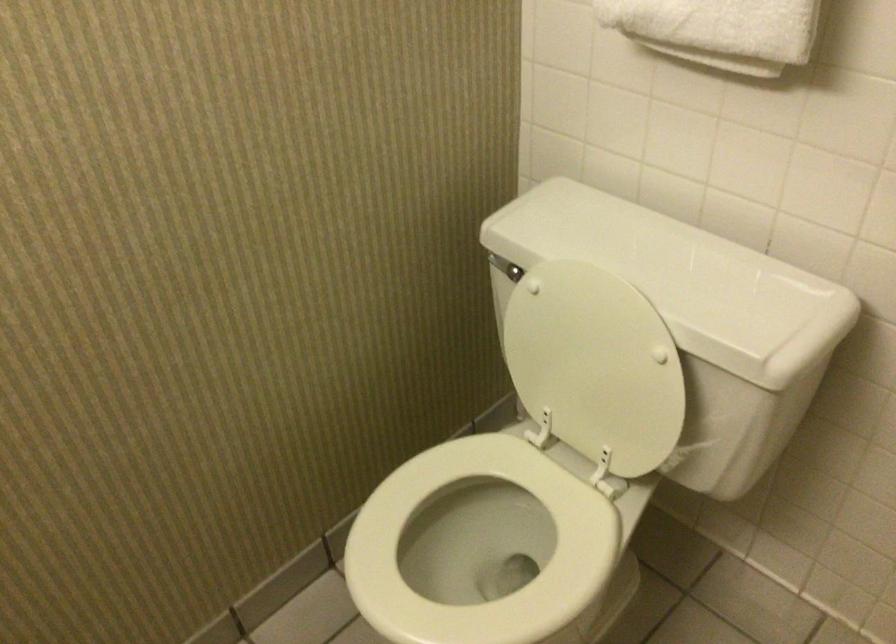
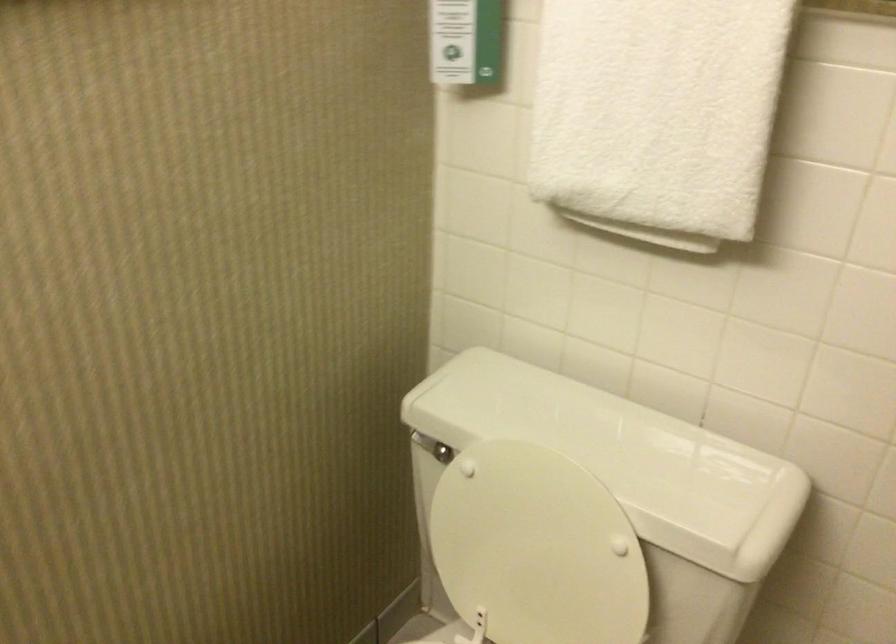
Locate, in the second image, the point that corresponds to point 502,263 in the first image.

(425, 444)